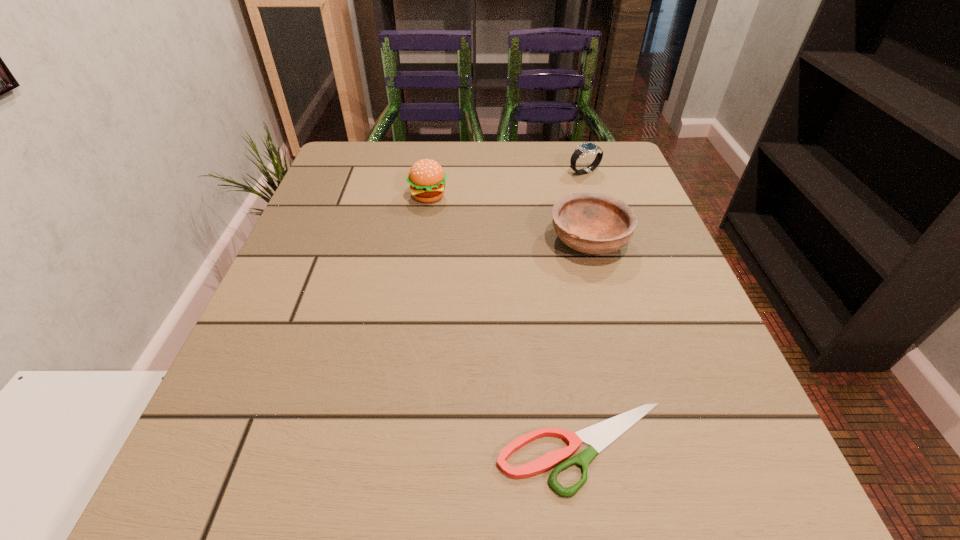
The width and height of the screenshot is (960, 540). In order to click on vacant space at the right edge in this screenshot , I will do `click(642, 249)`.

The image size is (960, 540). I want to click on vacant space at the far left corner, so click(x=372, y=146).

This screenshot has height=540, width=960. In the image, there is a desktop. What are the coordinates of `vacant space at the far right corner` in the screenshot? It's located at (612, 158).

Where is `vacant position at the near right corner of the desktop`? vacant position at the near right corner of the desktop is located at coordinates (756, 509).

Find the location of a particular element. vacant space that is in between the bowl and the hamburger is located at coordinates (509, 219).

This screenshot has height=540, width=960. I want to click on blank region between the watch and the shortest object, so click(x=585, y=309).

What are the coordinates of `vacant space that's between the shortest object and the bowl` in the screenshot? It's located at (587, 344).

The height and width of the screenshot is (540, 960). Identify the location of free space between the nearest object and the farthest object. (585, 309).

Where is `vacant space in between the tallest object and the farthest object`? vacant space in between the tallest object and the farthest object is located at coordinates (506, 184).

Where is `vacant point located between the hamburger and the watch`? This screenshot has width=960, height=540. vacant point located between the hamburger and the watch is located at coordinates (506, 184).